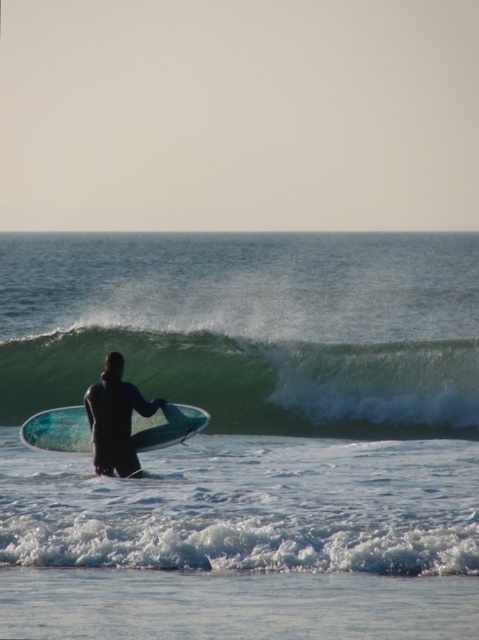
Who is more distant from viewer, (x=244, y=426) or (x=129, y=435)?

The point (x=244, y=426) is behind.

Which is in front, point (457, 588) or point (101, 440)?

Point (457, 588) is more forward.

Locate an element on the screen. This screenshot has height=640, width=479. translucent blue water at center is located at coordinates click(248, 435).

Does green rubber wave at center have a smaller size compared to translucent blue surfboard at center?

Correct, green rubber wave at center occupies less space than translucent blue surfboard at center.

Who is positioned more to the right, green rubber wave at center or translucent blue surfboard at center?

green rubber wave at center is more to the right.

Consider the image. Who is more forward, (470, 432) or (82, 413)?

Point (82, 413) is in front.

Locate an element on the screen. The width and height of the screenshot is (479, 640). green rubber wave at center is located at coordinates (260, 380).

Is green rubber wave at center to the right of black wetsuit surfer at center from the viewer's perspective?

Yes, green rubber wave at center is to the right of black wetsuit surfer at center.

Is point (55, 380) positioned before point (99, 467)?

No, (55, 380) is behind (99, 467).

I want to click on green rubber wave at center, so pos(260,380).